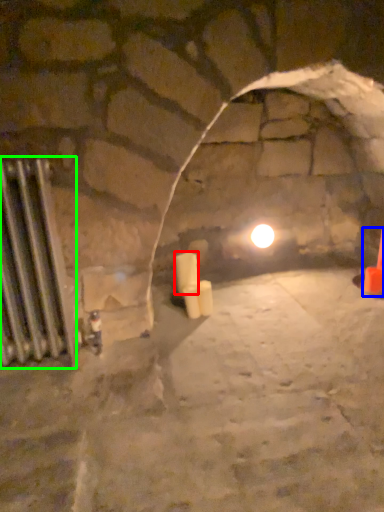
Question: Considering the real-world distances, which object is closest to candle (highlighted by a red box)? traffic cone (highlighted by a blue box) or radiator (highlighted by a green box).

Choices:
 (A) traffic cone
 (B) radiator

Answer: (B)